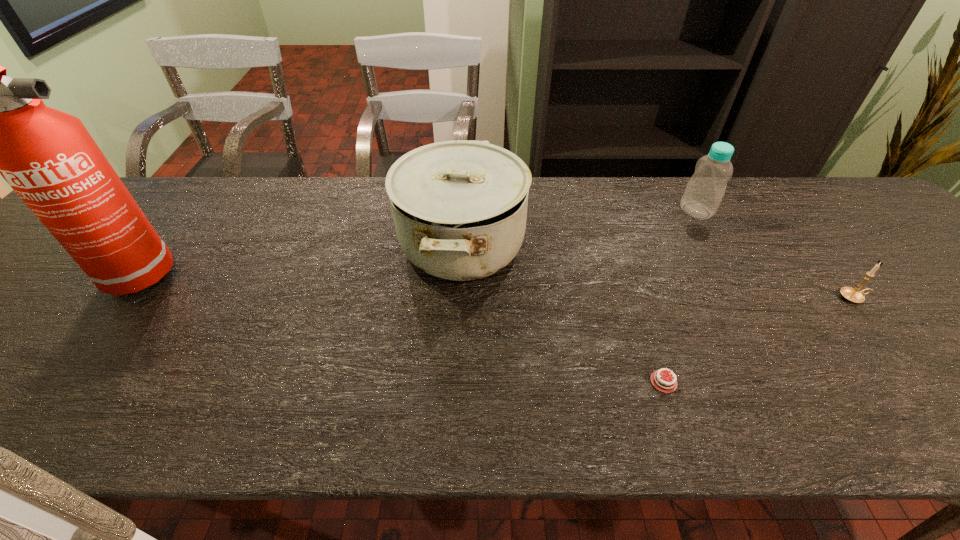
Where is `fire extinguisher`? fire extinguisher is located at coordinates (0, 126).

Where is `the leftmost object`? This screenshot has height=540, width=960. the leftmost object is located at coordinates (0, 126).

At what (x,y) coordinates should I click in order to perform the action: click on the second object from left to right. Please return your answer as a coordinate pair (x, y). Looking at the image, I should click on (459, 207).

Where is `the fourth object from left to right`? the fourth object from left to right is located at coordinates (704, 192).

This screenshot has height=540, width=960. In order to click on the rightmost object in this screenshot , I will do `click(854, 295)`.

Where is `the fourth tallest object`? the fourth tallest object is located at coordinates (854, 295).

Locate an element on the screen. The image size is (960, 540). the nearest object is located at coordinates (660, 380).

Locate an element on the screen. chocolate cake is located at coordinates (660, 380).

The image size is (960, 540). What are the coordinates of `vacant area located at the nozzle of the tallest object` in the screenshot? It's located at [236, 276].

At what (x,y) coordinates should I click in order to perform the action: click on free location located 0.190m on the right of the saucepan. Please return your answer as a coordinate pair (x, y). The image size is (960, 540). Looking at the image, I should click on (598, 244).